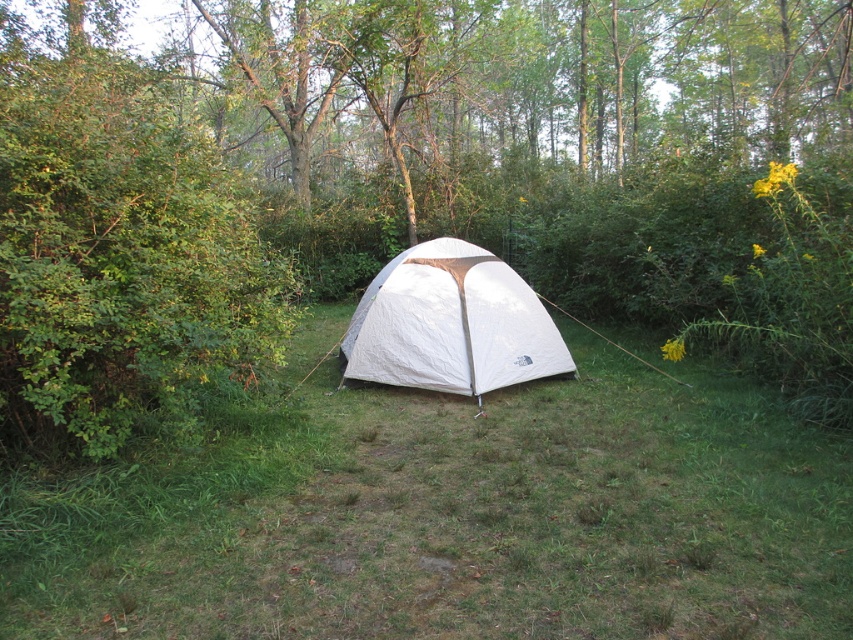
You are planning to set up a small garden in the area where the green grassy at center and the white fabric tent at center are located. Since you want the garden to be as large as possible, which area should you choose for planting?

The green grassy at center has a larger size compared to the white fabric tent at center, so you should choose the green grassy at center for the garden to maximize its size.

You are a hiker who wants to set up a tent in the camping area. The tent requires a flat area of at least 2 meters by 2 meters. Given the green grassy at center, can you determine if the area is suitable for pitching the tent?

The green grassy at center is located at coordinates point (451, 516), but the description does not provide information about the size or flatness of the area. Therefore, it is unclear if the area is suitable for pitching the tent.